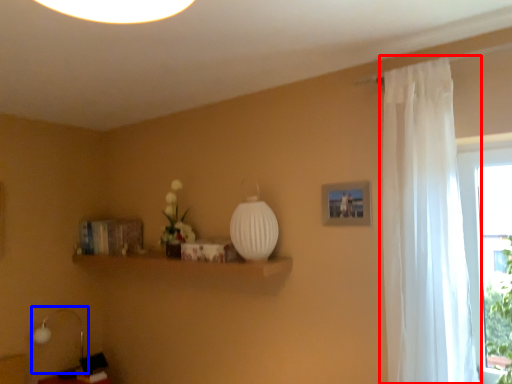
Question: Which object appears closest to the camera in this image, curtain (highlighted by a red box) or table lamp (highlighted by a blue box)?

Choices:
 (A) curtain
 (B) table lamp

Answer: (A)